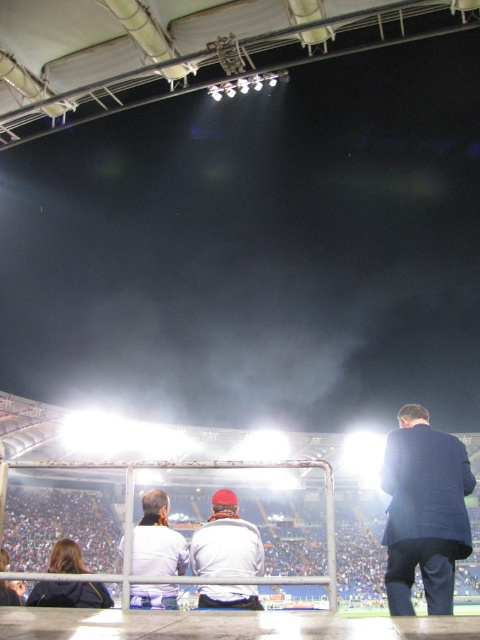
Is white matte jacket at center thinner than white fabric jacket at center?

Yes.

Between white matte jacket at center and white fabric jacket at center, which one has more height?

With more height is white fabric jacket at center.

Is point (249, 554) less distant than point (155, 518)?

That is True.

Identify the location of white matte jacket at center. The image size is (480, 640). (226, 541).

Looking at this image, does dark blue suit at right appear on the left side of white matte jacket at center?

In fact, dark blue suit at right is to the right of white matte jacket at center.

Is dark blue suit at right behind white matte jacket at center?

Yes.

Image resolution: width=480 pixels, height=640 pixels. What do you see at coordinates (423, 509) in the screenshot?
I see `dark blue suit at right` at bounding box center [423, 509].

I want to click on dark blue suit at right, so click(x=423, y=509).

Is point (412, 573) behind point (167, 515)?

No, it is in front of (167, 515).

Does dark blue suit at right have a smaller size compared to white fabric jacket at center?

Yes, dark blue suit at right is smaller than white fabric jacket at center.

Between point (402, 477) and point (172, 588), which one is positioned behind?

Positioned behind is point (172, 588).

Image resolution: width=480 pixels, height=640 pixels. I want to click on dark blue suit at right, so click(x=423, y=509).